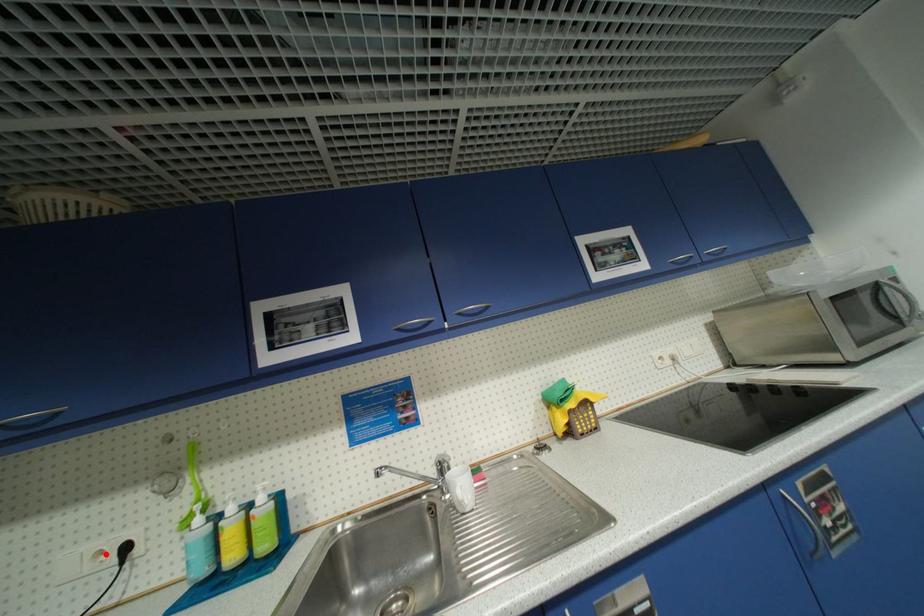
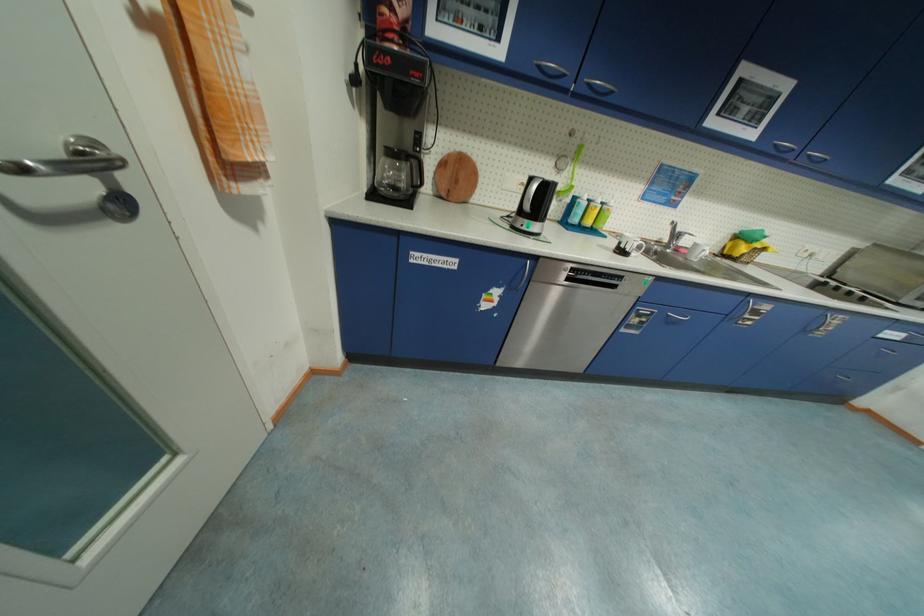
Locate, in the second image, the point that corresponds to the highlighted location in the first image.

(529, 185)